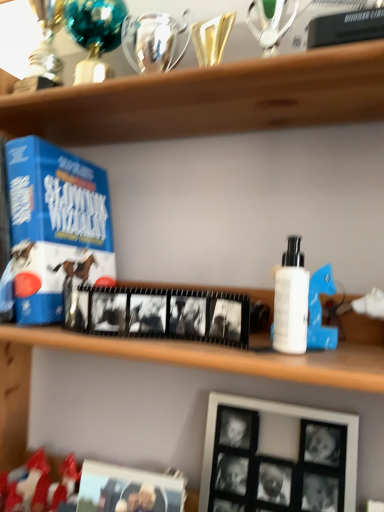
Question: Is black matte picture frame at lower center, the second picture frame viewed from the right, turned away from white matte bottle at right?

Choices:
 (A) yes
 (B) no

Answer: (B)

Question: From a real-world perspective, is black matte picture frame at lower center, which ranks as the first picture frame in left-to-right order, on top of white matte bottle at right?

Choices:
 (A) no
 (B) yes

Answer: (A)

Question: Does black matte picture frame at lower center, the second picture frame viewed from the right, turn towards white matte bottle at right?

Choices:
 (A) no
 (B) yes

Answer: (A)

Question: Is black matte picture frame at lower center, which ranks as the first picture frame in left-to-right order, outside white matte bottle at right?

Choices:
 (A) no
 (B) yes

Answer: (B)

Question: Is blue cardboard game at left bigger or smaller than black matte picture frame at lower center, the second picture frame viewed from the right?

Choices:
 (A) big
 (B) small

Answer: (A)

Question: From the image's perspective, is blue cardboard game at left located above or below black matte picture frame at lower center, which ranks as the first picture frame in left-to-right order?

Choices:
 (A) below
 (B) above

Answer: (B)

Question: Would you say blue cardboard game at left is inside or outside black matte picture frame at lower center, the second picture frame viewed from the right?

Choices:
 (A) inside
 (B) outside

Answer: (B)

Question: Considering their positions, is blue cardboard game at left located in front of or behind black matte picture frame at lower center, which ranks as the first picture frame in left-to-right order?

Choices:
 (A) behind
 (B) front

Answer: (A)

Question: From a real-world perspective, is blue cardboard game at left physically located above or below white matte bottle at right?

Choices:
 (A) above
 (B) below

Answer: (A)

Question: Do you think blue cardboard game at left is within white matte bottle at right, or outside of it?

Choices:
 (A) inside
 (B) outside

Answer: (B)

Question: From the image's perspective, is blue cardboard game at left positioned above or below white matte bottle at right?

Choices:
 (A) above
 (B) below

Answer: (A)

Question: Is blue cardboard game at left in front of or behind white matte bottle at right in the image?

Choices:
 (A) behind
 (B) front

Answer: (A)

Question: From a real-world perspective, relative to blue cardboard game at left, is white matte bottle at right vertically above or below?

Choices:
 (A) above
 (B) below

Answer: (B)

Question: Considering their positions, is white matte bottle at right located in front of or behind blue cardboard game at left?

Choices:
 (A) behind
 (B) front

Answer: (B)